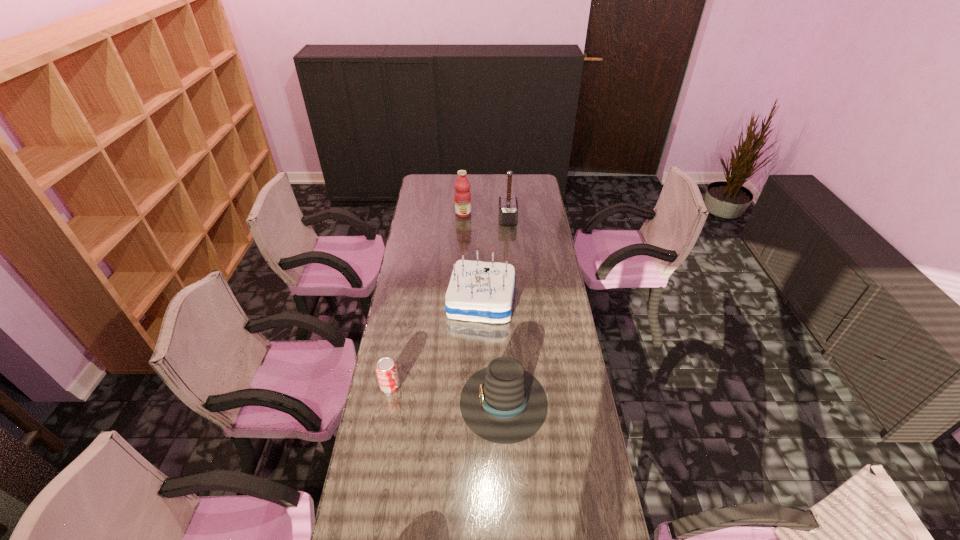
You are a GUI agent. You are given a task and a screenshot of the screen. Output one action in this format:
    pyautogui.click(x=<x>, y=<y>)
    Task: Click on the free location located 0.310m on the front-facing side of the fourth tallest object
    This screenshot has height=540, width=960.
    Given the screenshot: What is the action you would take?
    pyautogui.click(x=372, y=401)

Image resolution: width=960 pixels, height=540 pixels. Identify the location of free space located 0.260m on the front-facing side of the fourth tallest object. (386, 401).

Locate an element on the screen. This screenshot has height=540, width=960. free space located 0.200m on the back of the leftmost object is located at coordinates (399, 336).

Where is `object present at the left edge`? The height and width of the screenshot is (540, 960). object present at the left edge is located at coordinates (386, 369).

Where is `object that is at the right edge`? The height and width of the screenshot is (540, 960). object that is at the right edge is located at coordinates (502, 403).

Locate an element on the screen. vacant space at the far edge of the desktop is located at coordinates (478, 181).

I want to click on free space at the left edge of the desktop, so click(402, 312).

Image resolution: width=960 pixels, height=540 pixels. In the image, there is a desktop. What are the coordinates of `vacant space at the right edge` in the screenshot? It's located at (550, 373).

Find the location of `free space at the far right corner`. free space at the far right corner is located at coordinates (522, 179).

I want to click on vacant space in between the hat and the third nearest object, so coord(492,352).